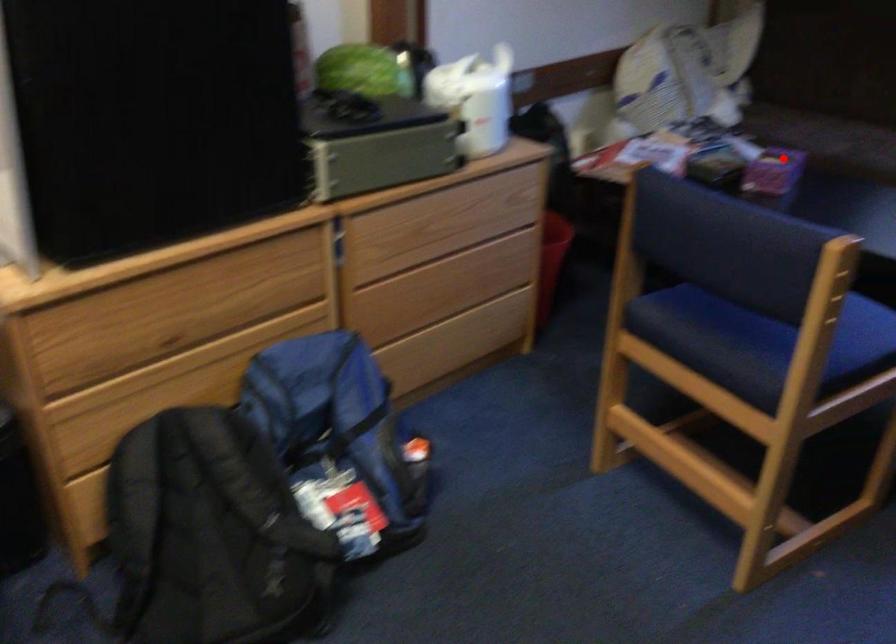
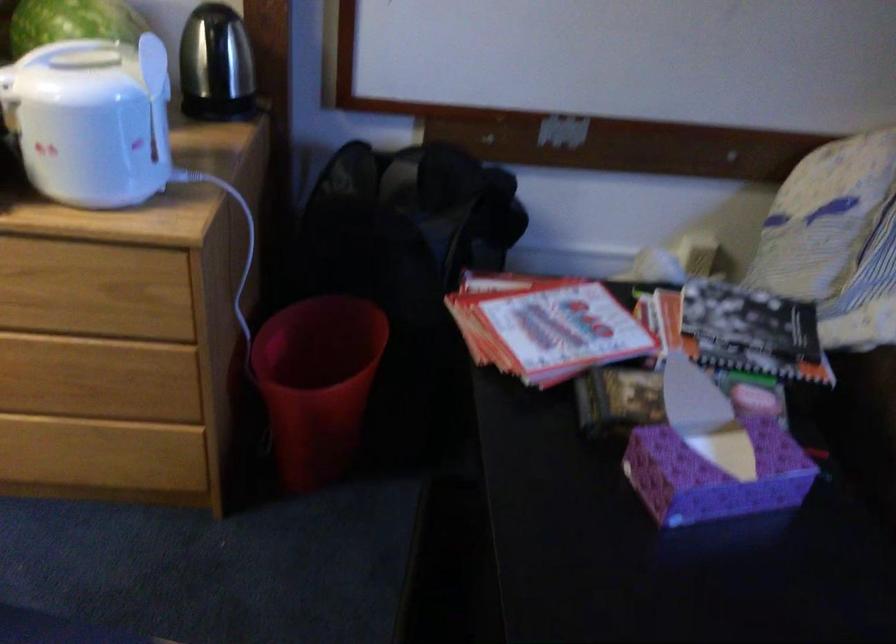
The point at the highlighted location is marked in the first image. Where is the corresponding point in the second image?

(714, 475)